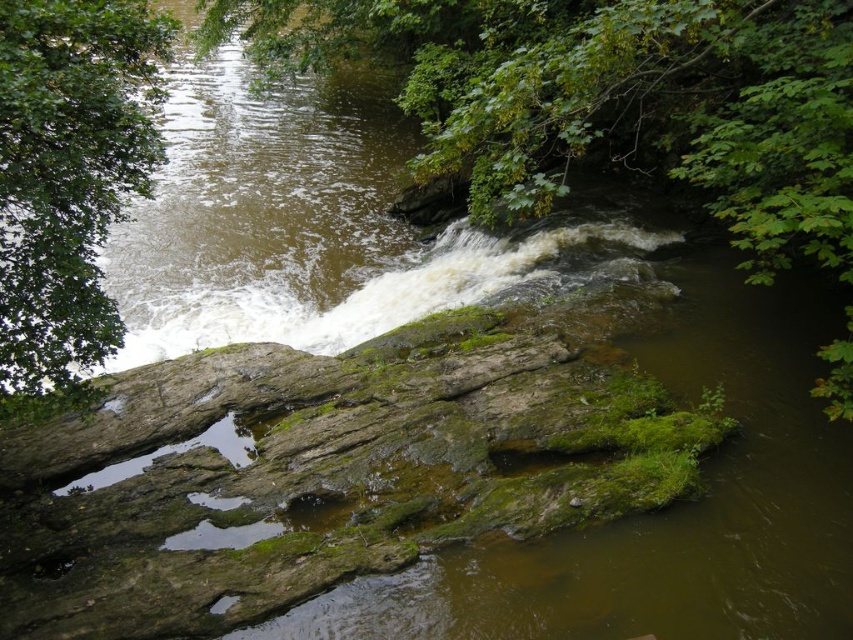
Is green leafy tree at upper center positioned behind green leafy tree at upper left?

Yes.

Who is more forward, (538, 204) or (44, 176)?

Point (44, 176) is in front.

I want to click on green leafy tree at upper center, so click(605, 99).